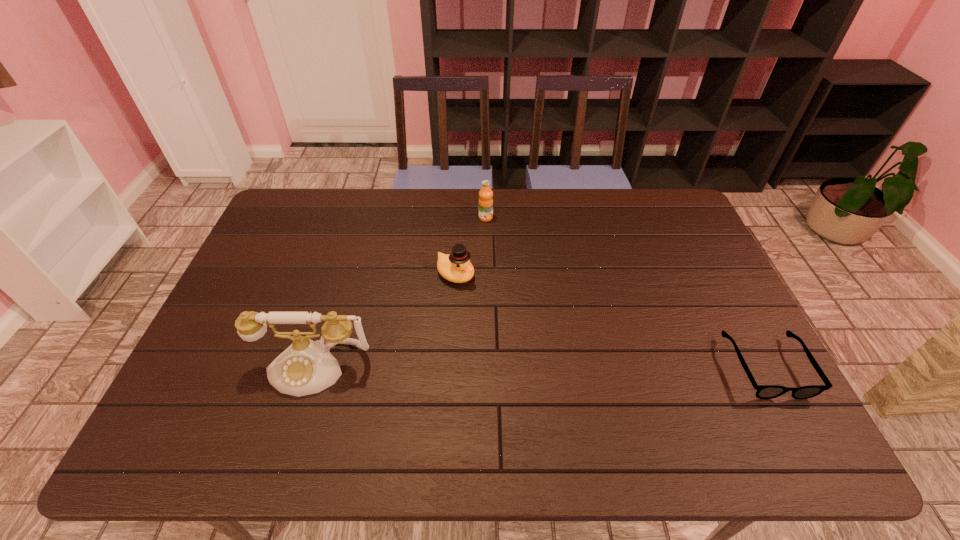
Where is `vacant space on the desktop that is between the telephone and the shortest object and is positioned on the label of the orange juice`? The width and height of the screenshot is (960, 540). vacant space on the desktop that is between the telephone and the shortest object and is positioned on the label of the orange juice is located at coordinates (594, 367).

Where is `vacant space on the desktop that is between the leftmost object and the shortest object and is positioned on the front-facing side of the second object from left to right`? vacant space on the desktop that is between the leftmost object and the shortest object and is positioned on the front-facing side of the second object from left to right is located at coordinates (588, 367).